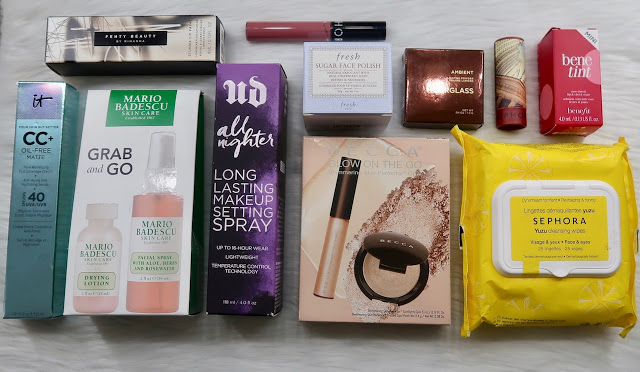
I want to click on box, so click(381, 142).